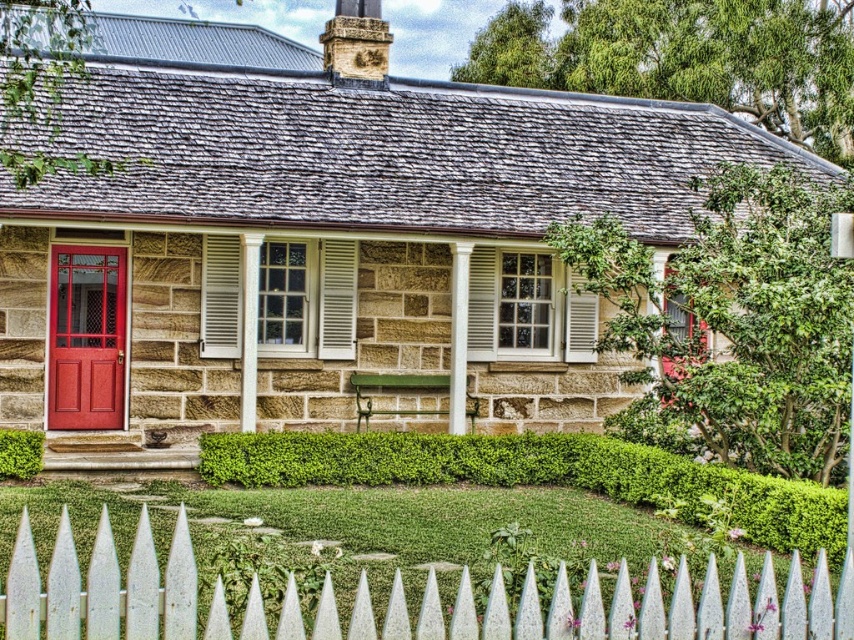
You are standing in front of the cottage and want to walk towards the white wooden picket fence at lower center and the matte red door at left. Which object will you reach first?

Answer: The white wooden picket fence at lower center is closer to the viewer than the matte red door at left, so you will reach the white wooden picket fence at lower center first.

You are standing in front of the cottage and want to sit on the green leafy hedge at lower left. Which direction should you move to reach it from the white wood shutter at center?

The green leafy hedge at lower left is to the left of the white wood shutter at center, so you should move to the left to reach it.